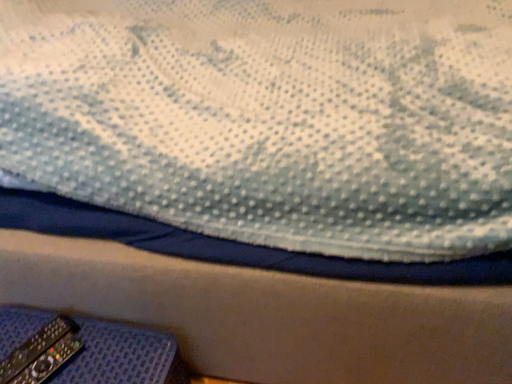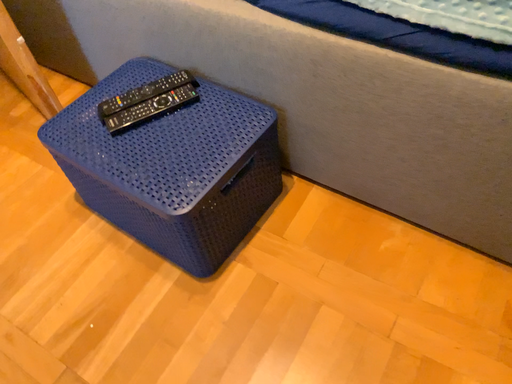
Question: How did the camera likely rotate when shooting the video?

Choices:
 (A) rotated right
 (B) rotated left

Answer: (B)